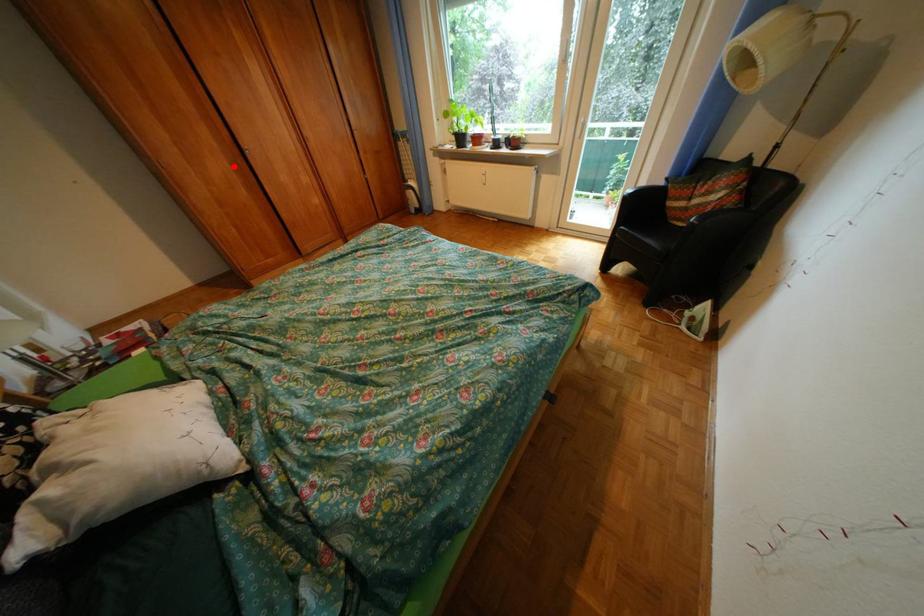
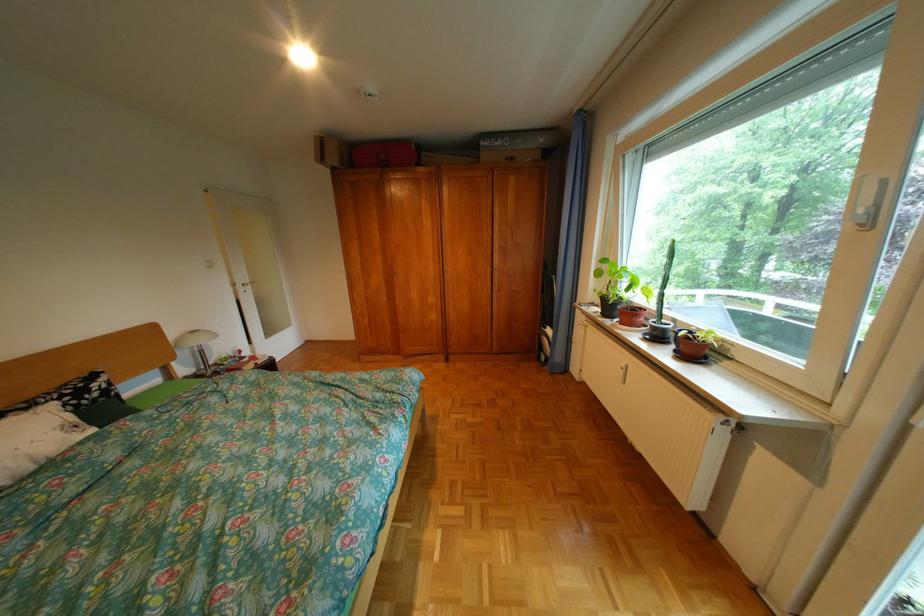
Where in the second image is the point corresponding to the highlighted location from the first image?

(392, 280)